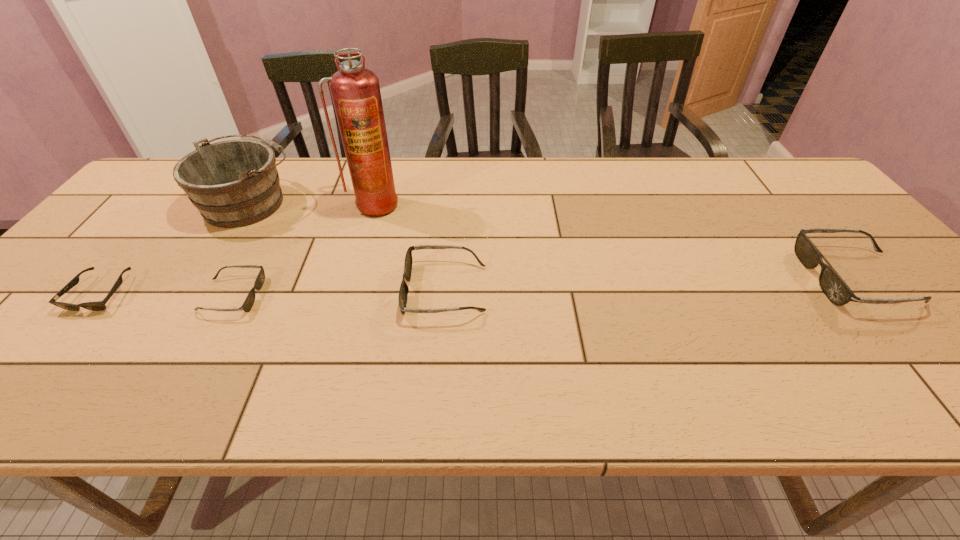
You are a GUI agent. You are given a task and a screenshot of the screen. Output one action in this format:
    pyautogui.click(x=<x>, y=<y>)
    Task: Click on the vacant point located between the leftmost sunglasses and the rightmost object
    
    Given the screenshot: What is the action you would take?
    pyautogui.click(x=478, y=286)

Locate an element on the screen. Image resolution: width=960 pixels, height=540 pixels. empty space that is in between the rightmost object and the wine bucket is located at coordinates (553, 240).

This screenshot has width=960, height=540. I want to click on empty location between the rightmost sunglasses and the third shortest sunglasses, so click(x=651, y=284).

Locate an element on the screen. This screenshot has height=540, width=960. free point between the rightmost object and the leftmost object is located at coordinates click(478, 286).

The image size is (960, 540). Identify the location of empty space between the second sunglasses from left to right and the rightmost object. (544, 287).

Where is `vacant space in between the fourth tallest object and the second tallest object`? The width and height of the screenshot is (960, 540). vacant space in between the fourth tallest object and the second tallest object is located at coordinates (348, 246).

Locate an element on the screen. the third closest object to the wine bucket is located at coordinates (249, 301).

I want to click on object that stands as the third closest to the tallest object, so click(249, 301).

The image size is (960, 540). I want to click on the third closest sunglasses to the leftmost object, so click(x=833, y=286).

The height and width of the screenshot is (540, 960). What are the coordinates of `sunglasses that stands as the third closest to the second tallest object` in the screenshot? It's located at (403, 291).